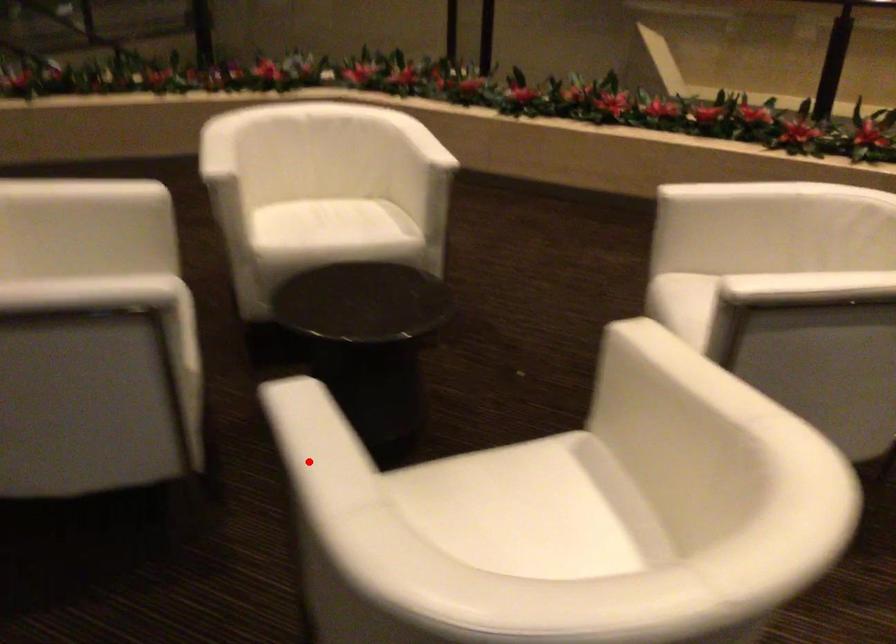
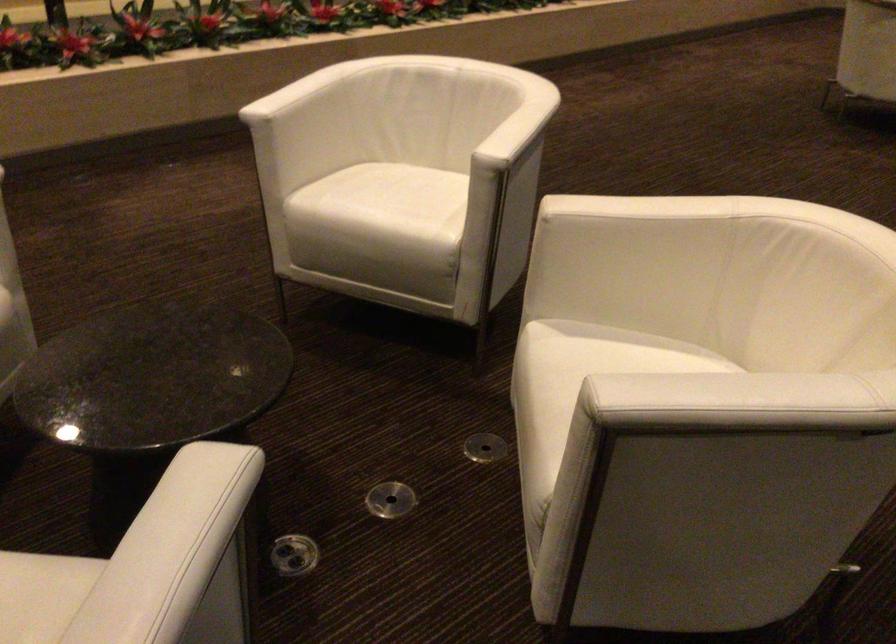
The point at the highlighted location is marked in the first image. Where is the corresponding point in the second image?

(737, 402)